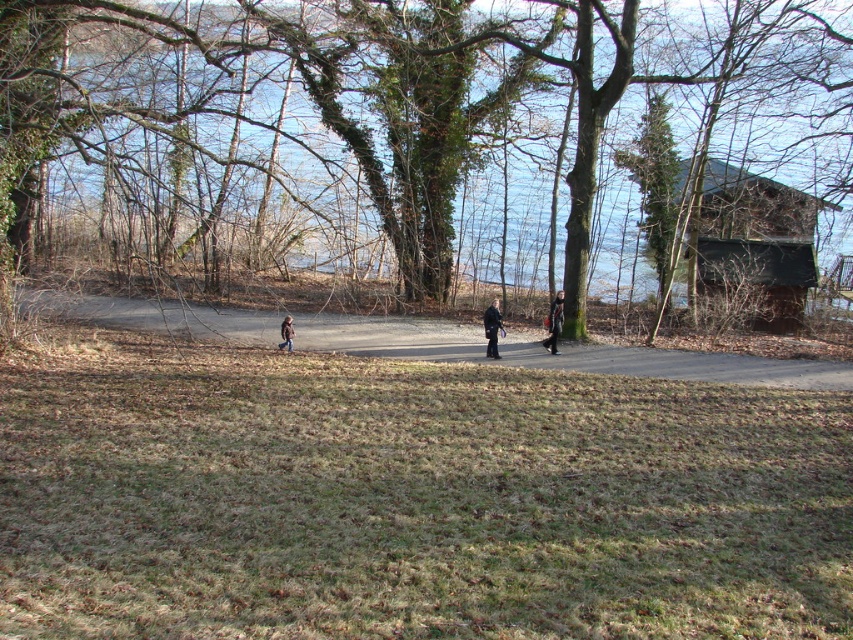
Who is positioned more to the left, brown textured tree at center or dark gray jacket at center?

From the viewer's perspective, brown textured tree at center appears more on the left side.

Who is shorter, brown textured tree at center or dark gray jacket at center?

dark gray jacket at center

The width and height of the screenshot is (853, 640). I want to click on brown textured tree at center, so click(x=415, y=138).

Can you confirm if dirt road at center is bigger than brown fuzzy jacket at center?

Yes, dirt road at center is bigger than brown fuzzy jacket at center.

Is dirt road at center below brown fuzzy jacket at center?

No, dirt road at center is not below brown fuzzy jacket at center.

Who is more distant from viewer, [270,330] or [286,324]?

The point [270,330] is behind.

The image size is (853, 640). Identify the location of dirt road at center. [677, 364].

Can you confirm if dark gray jacket at center is positioned below brown fuzzy jacket at center?

Incorrect, dark gray jacket at center is not positioned below brown fuzzy jacket at center.

Is dark gray jacket at center to the right of brown fuzzy jacket at center from the viewer's perspective?

Correct, you'll find dark gray jacket at center to the right of brown fuzzy jacket at center.

You are a GUI agent. You are given a task and a screenshot of the screen. Output one action in this format:
    pyautogui.click(x=<x>, y=<y>)
    Task: Click on the dark gray jacket at center
    
    Given the screenshot: What is the action you would take?
    pyautogui.click(x=554, y=323)